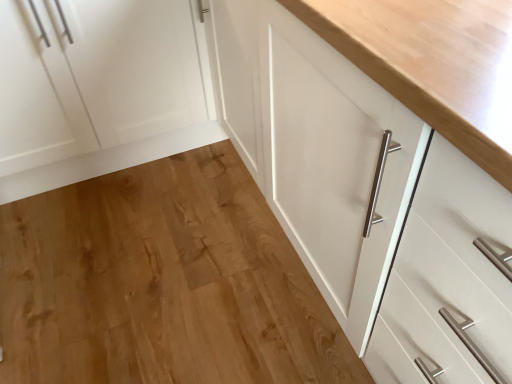
This screenshot has width=512, height=384. What are the coordinates of `free space above natural wood floor at center (from a real-world perspective)` in the screenshot? It's located at (182, 267).